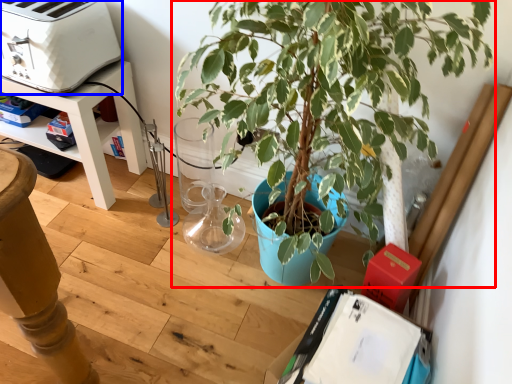
Question: Which object appears farthest to the camera in this image, houseplant (highlighted by a red box) or appliance (highlighted by a blue box)?

Choices:
 (A) houseplant
 (B) appliance

Answer: (B)